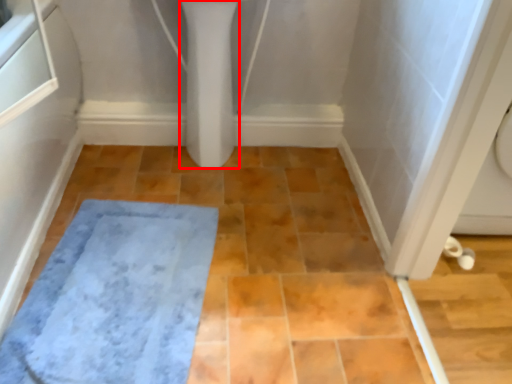
Question: Considering the relative positions of bidet (annotated by the red box) and bath mat in the image provided, where is bidet (annotated by the red box) located with respect to the staircase?

Choices:
 (A) left
 (B) right

Answer: (B)